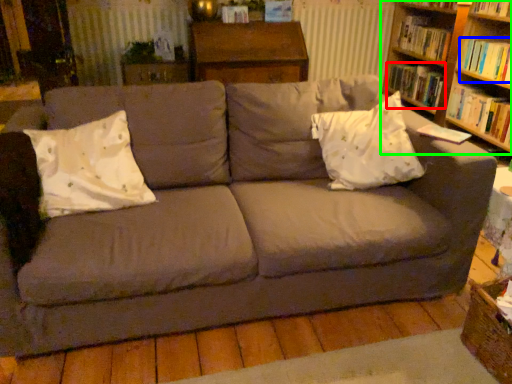
Question: Based on their relative distances, which object is nearer to book (highlighted by a red box)? Choose from book (highlighted by a blue box) and bookcase (highlighted by a green box).

Choices:
 (A) book
 (B) bookcase

Answer: (B)